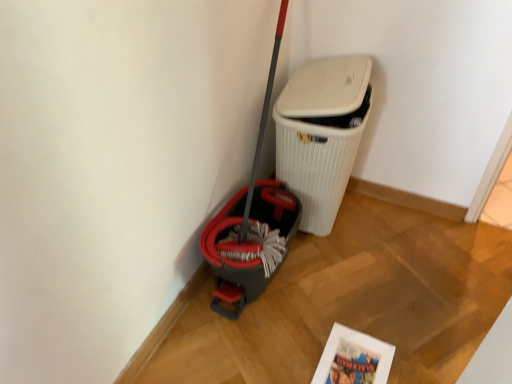
Identify the location of unoccupied region to the right of matte white comic book at lower center. Image resolution: width=512 pixels, height=384 pixels. (416, 352).